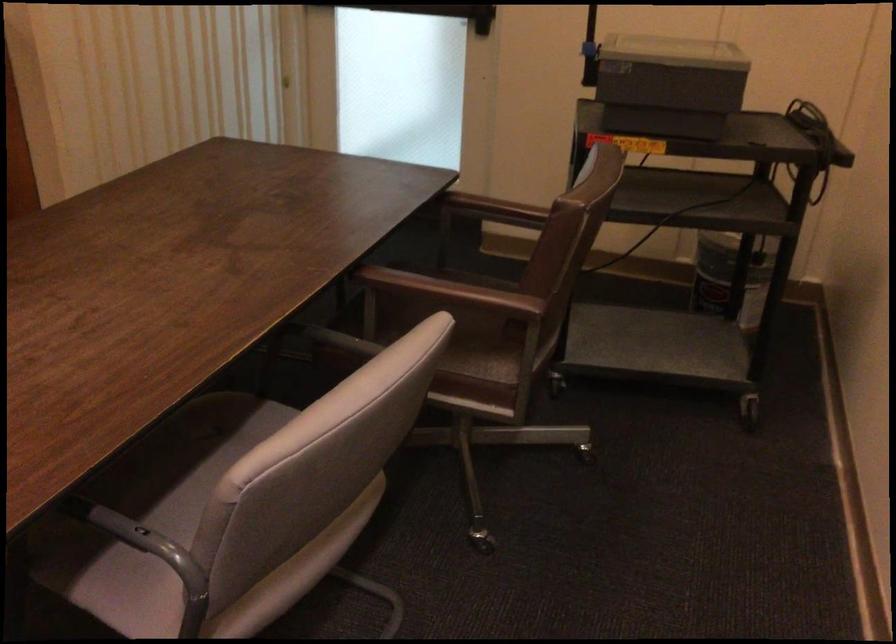
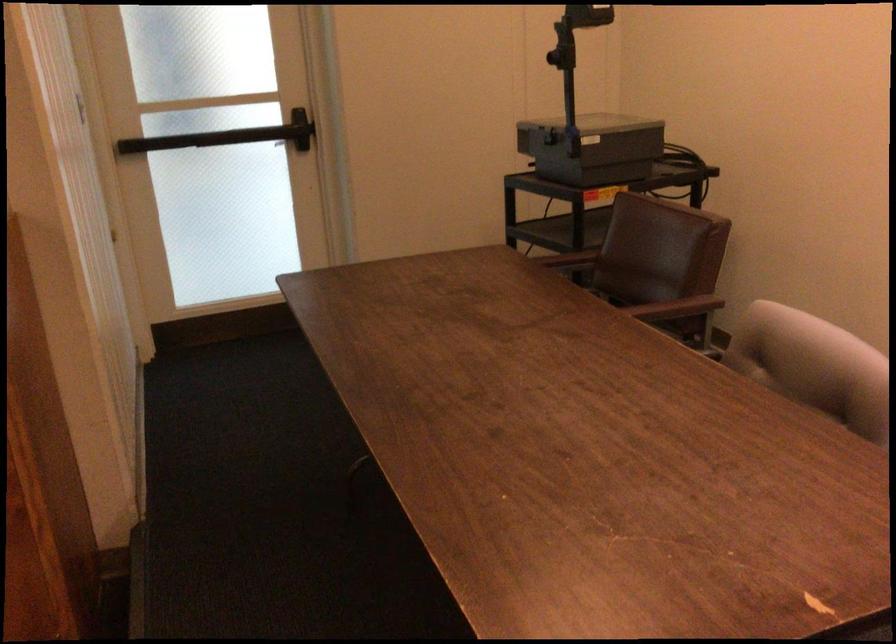
Question: I am providing you with two images of the same scene from different viewpoints. After the viewpoint changes to image2, which objects are now occluded?

Choices:
 (A) overhead projector
 (B) brown chair armrest
 (C) black door push bar
 (D) white stapler

Answer: (B)